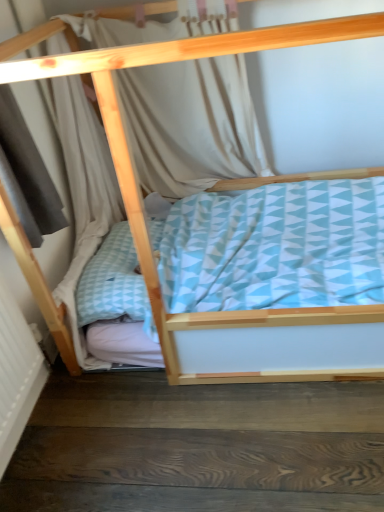
Question: From a real-world perspective, is light beige fabric curtain at upper center located beneath dark wood stair at lower left?

Choices:
 (A) no
 (B) yes

Answer: (A)

Question: Does light beige fabric curtain at upper center have a lesser width compared to dark wood stair at lower left?

Choices:
 (A) no
 (B) yes

Answer: (B)

Question: Considering the relative positions of light beige fabric curtain at upper center and dark wood stair at lower left in the image provided, is light beige fabric curtain at upper center in front of dark wood stair at lower left?

Choices:
 (A) yes
 (B) no

Answer: (B)

Question: From a real-world perspective, is light beige fabric curtain at upper center located higher than dark wood stair at lower left?

Choices:
 (A) yes
 (B) no

Answer: (A)

Question: Is light beige fabric curtain at upper center not near dark wood stair at lower left?

Choices:
 (A) no
 (B) yes

Answer: (B)

Question: From the image's perspective, is light beige fabric curtain at upper center on dark wood stair at lower left?

Choices:
 (A) no
 (B) yes

Answer: (B)

Question: From a real-world perspective, does dark wood stair at lower left sit lower than light beige fabric curtain at upper center?

Choices:
 (A) no
 (B) yes

Answer: (B)

Question: From the image's perspective, is dark wood stair at lower left on light beige fabric curtain at upper center?

Choices:
 (A) yes
 (B) no

Answer: (B)

Question: Is dark wood stair at lower left wider than light beige fabric curtain at upper center?

Choices:
 (A) yes
 (B) no

Answer: (A)

Question: Are dark wood stair at lower left and light beige fabric curtain at upper center located far from each other?

Choices:
 (A) no
 (B) yes

Answer: (B)

Question: Would you say dark wood stair at lower left is outside light beige fabric curtain at upper center?

Choices:
 (A) yes
 (B) no

Answer: (A)

Question: Is dark wood stair at lower left placed right next to light beige fabric curtain at upper center?

Choices:
 (A) yes
 (B) no

Answer: (B)

Question: In the image, is light beige fabric curtain at upper center positioned in front of or behind dark wood stair at lower left?

Choices:
 (A) behind
 (B) front

Answer: (A)